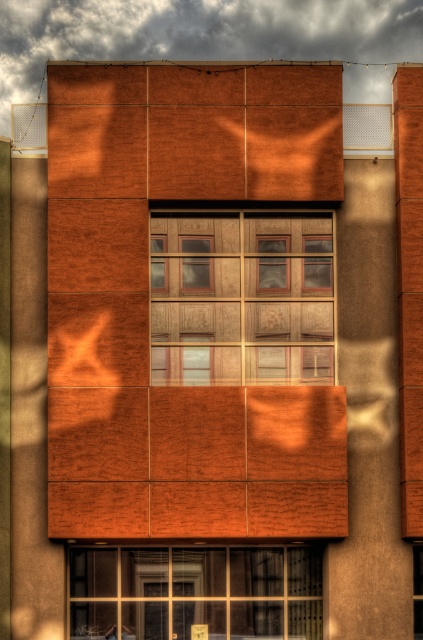
Does wooden windows at center appear under clear glass window at lower center?

Incorrect, wooden windows at center is not positioned below clear glass window at lower center.

Who is more distant from viewer, [315,282] or [134,616]?

Point [315,282]

Identify the location of wooden windows at center. The width and height of the screenshot is (423, 640). (241, 298).